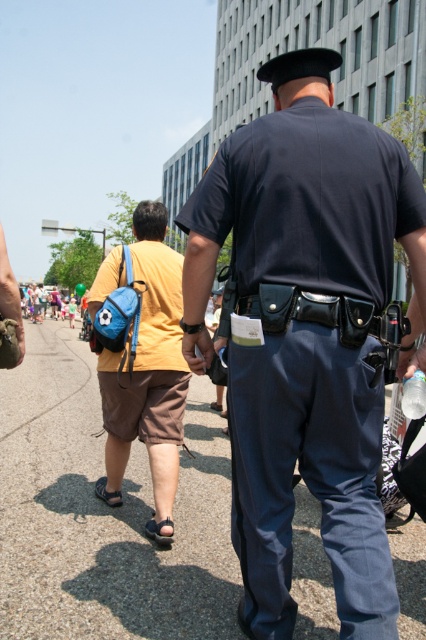
You are a delivery robot with a height of 1.8 meters. You are navigating through the scene and need to pass between the navy blue uniform at center and the gray asphalt pavement at center. Can you fit through the space between them without tilting or bending?

The navy blue uniform at center and the gray asphalt pavement at center are 1.89 meters apart from each other. Since the robot is 1.8 meters tall, it can fit through the space between them because the distance is slightly larger than the robot.

You are a photographer trying to capture a photo of the navy blue uniform at center and the matte blue backpack at center. If you want to ensure both are fully visible in the frame, which object should you focus on first to account for their sizes?

The navy blue uniform at center has a greater height compared to the matte blue backpack at center, so you should focus on the navy blue uniform at center first to ensure it fits within the frame before adjusting for the smaller backpack.